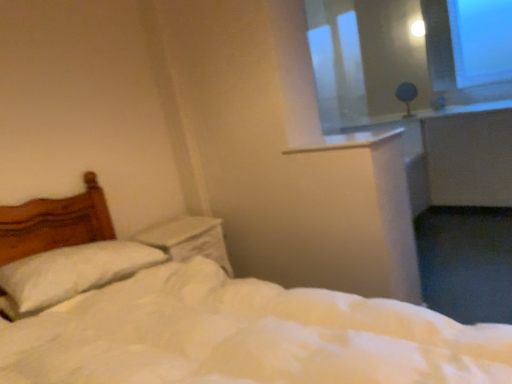
Question: From the image's perspective, is white soft pillow at left located above or below matte gray table lamp at upper right?

Choices:
 (A) below
 (B) above

Answer: (A)

Question: From their relative heights in the image, would you say white soft pillow at left is taller or shorter than matte gray table lamp at upper right?

Choices:
 (A) short
 (B) tall

Answer: (A)

Question: Estimate the real-world distances between objects in this image. Which object is closer to the transparent plastic window screen at upper right?

Choices:
 (A) white soft bed at center
 (B) white soft pillow at left
 (C) matte gray table lamp at upper right
 (D) white plastic window sill at upper center

Answer: (C)

Question: Which is farther from the matte gray table lamp at upper right?

Choices:
 (A) white soft bed at center
 (B) white soft pillow at left
 (C) white plastic window sill at upper center
 (D) transparent plastic window screen at upper right

Answer: (A)